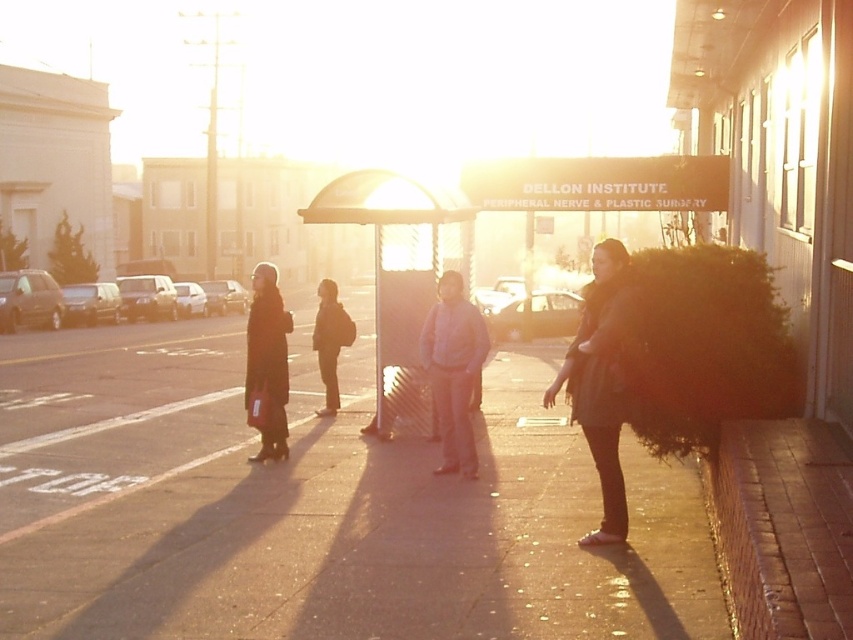
Who is more distant from viewer, (659, 547) or (587, 388)?

Positioned behind is point (659, 547).

Can you confirm if smooth concrete sidewalk at center is positioned to the right of dark brown fur coat at right?

In fact, smooth concrete sidewalk at center is to the left of dark brown fur coat at right.

The height and width of the screenshot is (640, 853). Describe the element at coordinates (315, 506) in the screenshot. I see `smooth concrete sidewalk at center` at that location.

Locate an element on the screen. smooth concrete sidewalk at center is located at coordinates (315, 506).

Does metallic bus stop at center have a lesser width compared to dark gray jacket at center?

Correct, metallic bus stop at center's width is less than dark gray jacket at center's.

Is metallic bus stop at center positioned at the back of dark gray jacket at center?

That is False.

Locate an element on the screen. Image resolution: width=853 pixels, height=640 pixels. metallic bus stop at center is located at coordinates (399, 276).

Can you confirm if brick at lower right is shorter than metallic bus stop at center?

Incorrect, brick at lower right's height does not fall short of metallic bus stop at center's.

Does brick at lower right have a smaller size compared to metallic bus stop at center?

No.

Is point (721, 522) behind point (381, 406)?

No, it is not.

Locate an element on the screen. The height and width of the screenshot is (640, 853). brick at lower right is located at coordinates (782, 529).